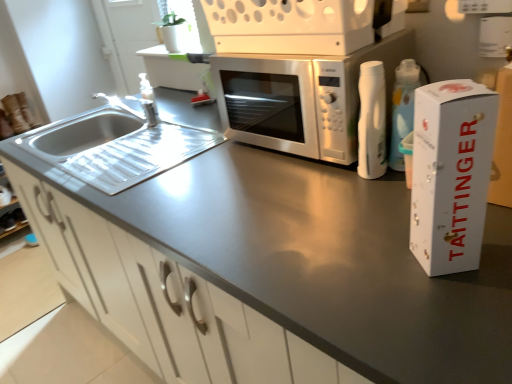
Image resolution: width=512 pixels, height=384 pixels. What are the coordinates of `satin silver microwave at center` in the screenshot? It's located at [x=302, y=98].

Identify the location of satin silver microwave at center. The image size is (512, 384). (298, 25).

Where is `satin silver microwave at center`? satin silver microwave at center is located at coordinates (302, 98).

Could you tell me if satin silver microwave at center is turned towards satin silver microwave at center?

No, satin silver microwave at center is not facing towards satin silver microwave at center.

Which of these two, satin silver microwave at center or satin silver microwave at center, is smaller?

satin silver microwave at center.

From a real-world perspective, is satin silver microwave at center beneath satin silver microwave at center?

No, from a real-world perspective, satin silver microwave at center is not beneath satin silver microwave at center.

Could you tell me if stainless steel sink at left is facing satin silver microwave at center?

No, stainless steel sink at left is not turned towards satin silver microwave at center.

Is point (191, 126) positioned after point (313, 13)?

Yes, it is behind point (313, 13).

What's the angular difference between stainless steel sink at left and satin silver microwave at center's facing directions?

2.87 degrees separate the facing orientations of stainless steel sink at left and satin silver microwave at center.

Is stainless steel sink at left not near satin silver microwave at center?

No, stainless steel sink at left is in close proximity to satin silver microwave at center.

Is white cardboard box at right oriented away from satin silver microwave at center?

No, satin silver microwave at center is not at the back of white cardboard box at right.

Consider the image. Considering the sizes of objects white cardboard box at right and satin silver microwave at center in the image provided, who is bigger, white cardboard box at right or satin silver microwave at center?

satin silver microwave at center is bigger.

Is point (414, 232) closer to viewer compared to point (252, 106)?

Yes, it is in front of point (252, 106).

From a real-world perspective, who is located higher, white cardboard box at right or satin silver microwave at center?

white cardboard box at right.

Is the depth of stainless steel sink at left greater than that of white matte cabinet at center?

Yes, stainless steel sink at left is further from the viewer.

Does point (172, 133) come farther from viewer compared to point (100, 274)?

Yes, point (172, 133) is behind point (100, 274).

Considering the relative sizes of stainless steel sink at left and white matte cabinet at center in the image provided, is stainless steel sink at left smaller than white matte cabinet at center?

Correct, stainless steel sink at left occupies less space than white matte cabinet at center.

This screenshot has height=384, width=512. I want to click on sink that is on the left side of white matte cabinet at center, so click(117, 146).

Where is `appliance located on the left of white cardboard box at right`? The width and height of the screenshot is (512, 384). appliance located on the left of white cardboard box at right is located at coordinates (298, 25).

Is white cardboard box at right bigger than satin silver microwave at center?

No.

Which is closer, (413,221) or (295,0)?

Clearly, point (413,221) is closer to the camera than point (295,0).

From the image's perspective, is white cardboard box at right positioned above or below satin silver microwave at center?

Based on their image positions, white cardboard box at right is located beneath satin silver microwave at center.

Can you confirm if stainless steel sink at left is thinner than satin silver microwave at center?

Incorrect, the width of stainless steel sink at left is not less than that of satin silver microwave at center.

Between stainless steel sink at left and satin silver microwave at center, which one appears on the right side from the viewer's perspective?

satin silver microwave at center.

Is stainless steel sink at left inside or outside of satin silver microwave at center?

stainless steel sink at left lies outside satin silver microwave at center.

Based on their sizes in the image, would you say stainless steel sink at left is bigger or smaller than satin silver microwave at center?

Considering their sizes, stainless steel sink at left takes up more space than satin silver microwave at center.

At what (x,y) coordinates should I click in order to perform the action: click on microwave oven above the white cardboard box at right (from the image's perspective). Please return your answer as a coordinate pair (x, y). Looking at the image, I should click on (302, 98).

Does satin silver microwave at center turn towards white cardboard box at right?

No, satin silver microwave at center does not turn towards white cardboard box at right.

In the scene shown: Is satin silver microwave at center positioned beyond the bounds of white cardboard box at right?

That's correct, satin silver microwave at center is outside of white cardboard box at right.

At what (x,y) coordinates should I click in order to perform the action: click on appliance on the left of satin silver microwave at center. Please return your answer as a coordinate pair (x, y). This screenshot has width=512, height=384. Looking at the image, I should click on (298, 25).

Identify the location of appliance above the stainless steel sink at left (from a real-world perspective). (298, 25).

When comparing their distances from white matte cabinet at center, does stainless steel sink at left or white cardboard box at right seem further?

Among the two, white cardboard box at right is located further to white matte cabinet at center.

When comparing their distances from stainless steel sink at left, does white matte cabinet at center or satin silver microwave at center seem further?

satin silver microwave at center is positioned further to the anchor stainless steel sink at left.

Based on the photo, which object lies nearer to the anchor point satin silver microwave at center, white cardboard box at right or satin silver microwave at center?

satin silver microwave at center is closer to satin silver microwave at center.

From the image, which object appears to be nearer to satin silver microwave at center, white cardboard box at right or white matte cabinet at center?

Among the two, white cardboard box at right is located nearer to satin silver microwave at center.

Which object lies nearer to the anchor point stainless steel sink at left, white cardboard box at right or white matte cabinet at center?

white matte cabinet at center is positioned closer to the anchor stainless steel sink at left.

Consider the image. When comparing their distances from white matte cabinet at center, does satin silver microwave at center or satin silver microwave at center seem further?

satin silver microwave at center is positioned further to the anchor white matte cabinet at center.

When comparing their distances from satin silver microwave at center, does satin silver microwave at center or stainless steel sink at left seem further?

Among the two, stainless steel sink at left is located further to satin silver microwave at center.

Considering their positions, is white cardboard box at right positioned further to white matte cabinet at center than stainless steel sink at left?

Among the two, white cardboard box at right is located further to white matte cabinet at center.

This screenshot has height=384, width=512. In order to click on microwave oven between satin silver microwave at center and white matte cabinet at center in the vertical direction in this screenshot , I will do (302, 98).

Find the location of a particular element. Image resolution: width=512 pixels, height=384 pixels. appliance located between stainless steel sink at left and satin silver microwave at center in the left-right direction is located at coordinates (298, 25).

Find the location of a particular element. The width and height of the screenshot is (512, 384). microwave oven between stainless steel sink at left and white cardboard box at right is located at coordinates (302, 98).

Locate an element on the screen. This screenshot has height=384, width=512. microwave oven between satin silver microwave at center and white cardboard box at right vertically is located at coordinates (302, 98).